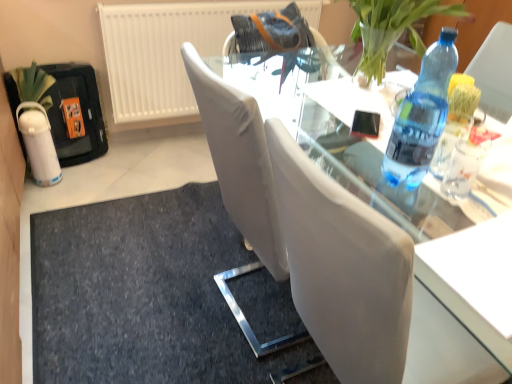
Locate an element on the screen. Image resolution: width=512 pixels, height=384 pixels. white textured radiator at upper left is located at coordinates click(162, 53).

Image resolution: width=512 pixels, height=384 pixels. Describe the element at coordinates (162, 53) in the screenshot. I see `white textured radiator at upper left` at that location.

Locate an element on the screen. This screenshot has width=512, height=384. blue plastic bottle at right is located at coordinates (421, 116).

What are the coordinates of `dark gray fabric doormat at lower center` in the screenshot? It's located at (142, 293).

Is dark gray fabric doormat at lower center in front of or behind white textured radiator at upper left in the image?

dark gray fabric doormat at lower center is in front of white textured radiator at upper left.

Is dark gray fabric doormat at lower center wider than white textured radiator at upper left?

Correct, the width of dark gray fabric doormat at lower center exceeds that of white textured radiator at upper left.

Is white textured radiator at upper left at the back of dark gray fabric doormat at lower center?

dark gray fabric doormat at lower center is not turned away from white textured radiator at upper left.

Considering the sizes of objects transparent glass table at center and white textured radiator at upper left in the image provided, who is bigger, transparent glass table at center or white textured radiator at upper left?

With larger size is transparent glass table at center.

From a real-world perspective, between transparent glass table at center and white textured radiator at upper left, who is vertically lower?

white textured radiator at upper left, from a real-world perspective.

Is transparent glass table at center completely or partially outside of white textured radiator at upper left?

Result: transparent glass table at center is positioned outside white textured radiator at upper left.

Is transparent glass table at center further to camera compared to white textured radiator at upper left?

No, transparent glass table at center is in front of white textured radiator at upper left.

Is the depth of white textured radiator at upper left greater than that of blue plastic bottle at right?

Yes, white textured radiator at upper left is behind blue plastic bottle at right.

Considering the relative sizes of white textured radiator at upper left and blue plastic bottle at right in the image provided, is white textured radiator at upper left wider than blue plastic bottle at right?

Correct, the width of white textured radiator at upper left exceeds that of blue plastic bottle at right.

Considering the sizes of white textured radiator at upper left and blue plastic bottle at right in the image, is white textured radiator at upper left bigger or smaller than blue plastic bottle at right?

In the image, white textured radiator at upper left appears to be larger than blue plastic bottle at right.

What's the angular difference between white textured radiator at upper left and blue plastic bottle at right's facing directions?

91.5 degrees.

How far apart are dark gray fabric doormat at lower center and blue plastic bottle at right?

dark gray fabric doormat at lower center is 38.26 inches away from blue plastic bottle at right.

Who is smaller, dark gray fabric doormat at lower center or blue plastic bottle at right?

blue plastic bottle at right.

Consider the image. Is dark gray fabric doormat at lower center aimed at blue plastic bottle at right?

No, dark gray fabric doormat at lower center is not turned towards blue plastic bottle at right.

This screenshot has width=512, height=384. In order to click on bottle that appears on the right of dark gray fabric doormat at lower center in this screenshot , I will do `click(421, 116)`.

You are a GUI agent. You are given a task and a screenshot of the screen. Output one action in this format:
    pyautogui.click(x=<x>, y=<y>)
    Task: Click on the bottle to the right of transparent glass table at center
    Image resolution: width=512 pixels, height=384 pixels.
    Given the screenshot: What is the action you would take?
    pyautogui.click(x=421, y=116)

Is transparent glass table at center far from blue plastic bottle at right?

→ No, transparent glass table at center is in close proximity to blue plastic bottle at right.

Which is in front, point (402, 226) or point (404, 147)?

The point (404, 147) is closer to the camera.

Looking at this image, how much distance is there between transparent glass table at center and blue plastic bottle at right?

transparent glass table at center and blue plastic bottle at right are 13.28 inches apart.

From the image's perspective, which is below, blue plastic bottle at right or dark gray fabric doormat at lower center?

dark gray fabric doormat at lower center.

Identify the location of doormat that is on the left side of blue plastic bottle at right. (142, 293).

Is point (412, 146) closer or farther from the camera than point (156, 369)?

Clearly, point (412, 146) is closer to the camera than point (156, 369).

Can you confirm if blue plastic bottle at right is thinner than dark gray fabric doormat at lower center?

Indeed, blue plastic bottle at right has a lesser width compared to dark gray fabric doormat at lower center.

Is blue plastic bottle at right touching white textured radiator at upper left?

There is a gap between blue plastic bottle at right and white textured radiator at upper left.

From the image's perspective, which is below, blue plastic bottle at right or white textured radiator at upper left?

blue plastic bottle at right, from the image's perspective.

From the picture: Can you tell me how much blue plastic bottle at right and white textured radiator at upper left differ in facing direction?

The facing directions of blue plastic bottle at right and white textured radiator at upper left are 91.5 degrees apart.

Considering the positions of objects blue plastic bottle at right and white textured radiator at upper left in the image provided, who is more to the left, blue plastic bottle at right or white textured radiator at upper left?

Positioned to the left is white textured radiator at upper left.

The height and width of the screenshot is (384, 512). In order to click on radiator above the dark gray fabric doormat at lower center (from the image's perspective) in this screenshot , I will do `click(162, 53)`.

Image resolution: width=512 pixels, height=384 pixels. I want to click on table that is above the white textured radiator at upper left (from a real-world perspective), so click(x=335, y=138).

Estimate the real-world distances between objects in this image. Which object is further from white textured radiator at upper left, dark gray fabric doormat at lower center or blue plastic bottle at right?

blue plastic bottle at right is further to white textured radiator at upper left.

When comparing their distances from dark gray fabric doormat at lower center, does blue plastic bottle at right or white textured radiator at upper left seem further?

blue plastic bottle at right.

Estimate the real-world distances between objects in this image. Which object is further from blue plastic bottle at right, dark gray fabric doormat at lower center or transparent glass table at center?

dark gray fabric doormat at lower center.

Based on the photo, considering their positions, is transparent glass table at center positioned closer to blue plastic bottle at right than dark gray fabric doormat at lower center?

transparent glass table at center.

Looking at the image, which one is located further to transparent glass table at center, dark gray fabric doormat at lower center or blue plastic bottle at right?

The object further to transparent glass table at center is dark gray fabric doormat at lower center.

Estimate the real-world distances between objects in this image. Which object is closer to blue plastic bottle at right, white textured radiator at upper left or transparent glass table at center?

transparent glass table at center lies closer to blue plastic bottle at right than the other object.

From the image, which object appears to be nearer to white textured radiator at upper left, transparent glass table at center or blue plastic bottle at right?

Among the two, transparent glass table at center is located nearer to white textured radiator at upper left.

From the image, which object appears to be nearer to white textured radiator at upper left, transparent glass table at center or dark gray fabric doormat at lower center?

transparent glass table at center lies closer to white textured radiator at upper left than the other object.

Identify the location of doormat located between transparent glass table at center and white textured radiator at upper left in the depth direction. The image size is (512, 384). (142, 293).

You are a GUI agent. You are given a task and a screenshot of the screen. Output one action in this format:
    pyautogui.click(x=<x>, y=<y>)
    Task: Click on the bottle between transparent glass table at center and white textured radiator at upper left along the z-axis
    
    Given the screenshot: What is the action you would take?
    pyautogui.click(x=421, y=116)

What are the coordinates of `doormat located between blue plastic bottle at right and white textured radiator at upper left in the depth direction` in the screenshot? It's located at (142, 293).

What are the coordinates of `table situated between dark gray fabric doormat at lower center and blue plastic bottle at right from left to right` in the screenshot? It's located at (335, 138).